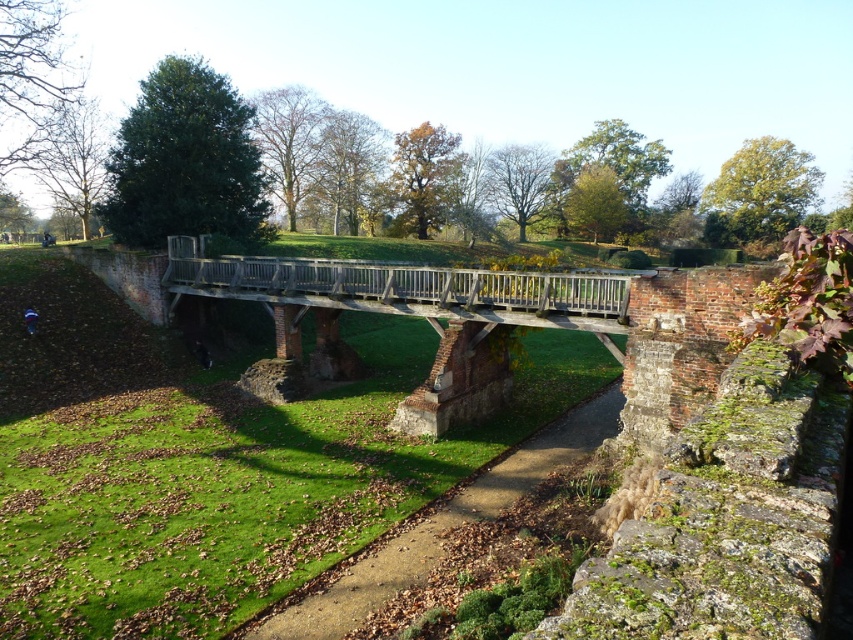
Is wooden bridge at center shorter than brown dirt path at lower center?

In fact, wooden bridge at center may be taller than brown dirt path at lower center.

Is point (544, 288) behind point (440, 515)?

Yes.

At what (x,y) coordinates should I click in order to perform the action: click on wooden bridge at center. Please return your answer as a coordinate pair (x, y). Looking at the image, I should click on (413, 314).